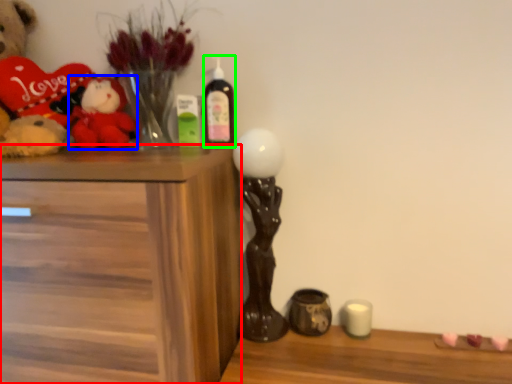
Question: Considering the real-world distances, which object is closest to chest of drawers (highlighted by a red box)? toy (highlighted by a blue box) or bottle (highlighted by a green box).

Choices:
 (A) toy
 (B) bottle

Answer: (A)